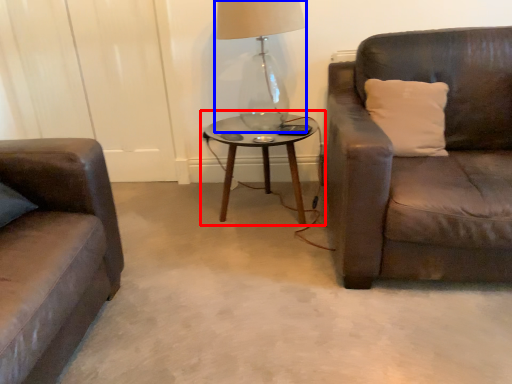
Question: Which object appears closest to the camera in this image, coffee table (highlighted by a red box) or table lamp (highlighted by a blue box)?

Choices:
 (A) coffee table
 (B) table lamp

Answer: (B)